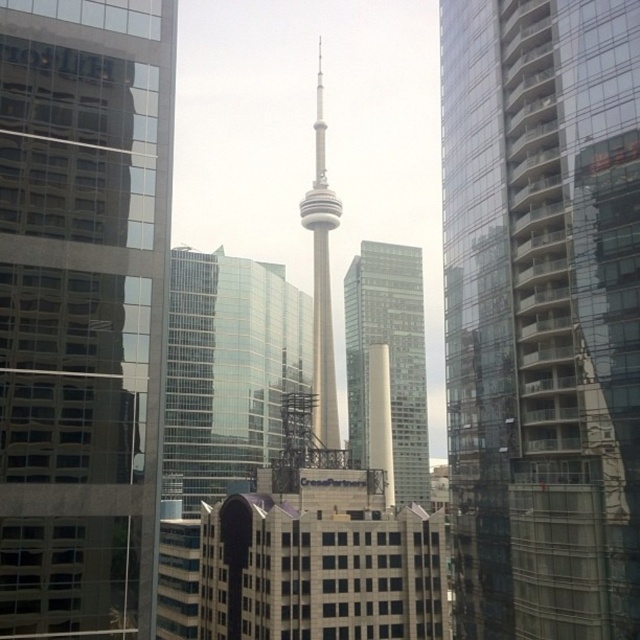
You are standing in the city and looking at the CN Tower in the background. There is a point marked at coordinates (541,314). Which object does this point belong to?

The point at coordinates (541,314) is on the transparent glass building at center.

You are an architect analyzing the city skyline. You notice the transparent glass skyscraper at left and the white glass tower at center. Which of these two buildings has a greater width?

The white glass tower at center has a greater width than the transparent glass skyscraper at left.